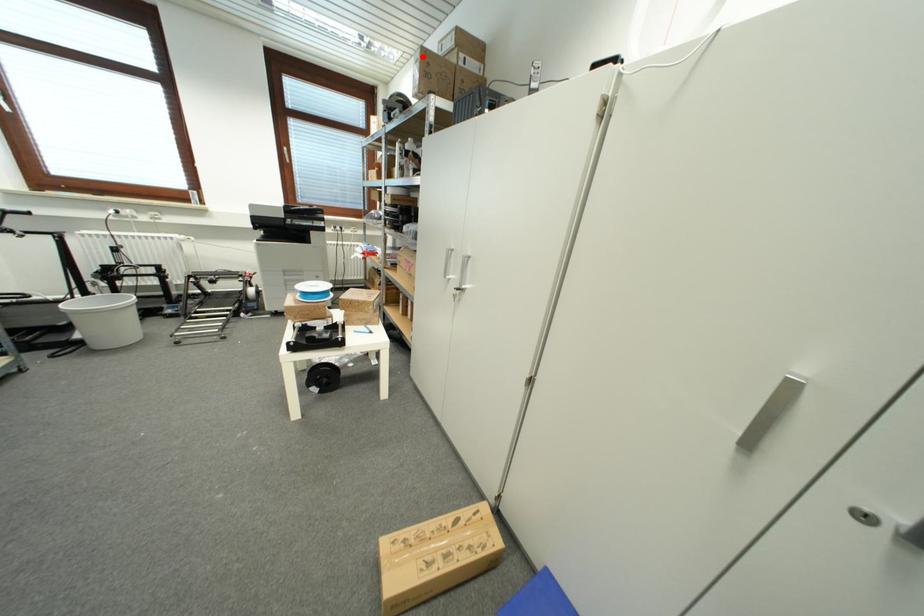
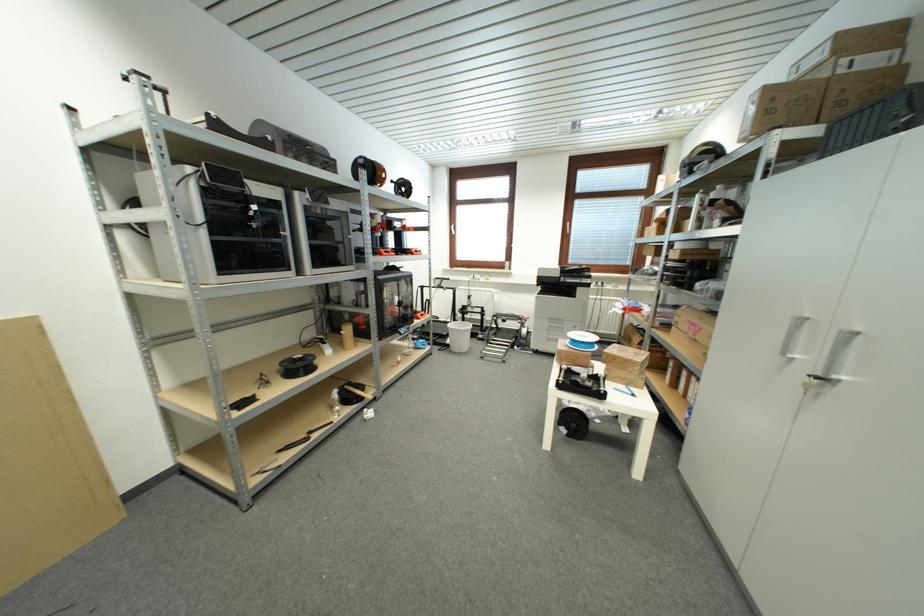
Find the pixel in the second image that matches the highlighted location in the first image.

(761, 99)